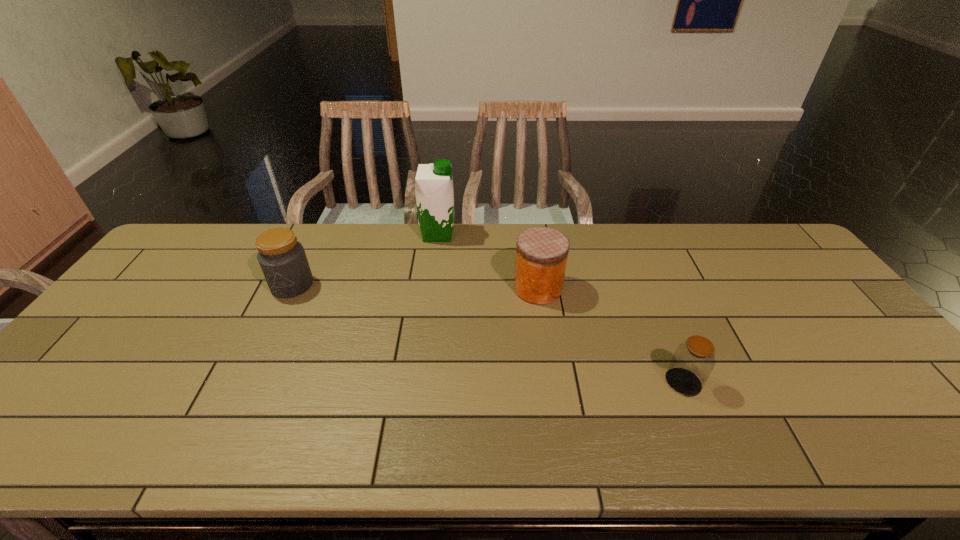
The width and height of the screenshot is (960, 540). I want to click on the third object from right to left, so click(434, 191).

At what (x,y) coordinates should I click in order to perform the action: click on soya milk. Please return your answer as a coordinate pair (x, y). Looking at the image, I should click on (434, 191).

Identify the location of the leftmost jar. (283, 261).

This screenshot has width=960, height=540. Find the location of `the second jar from right to left`. the second jar from right to left is located at coordinates (541, 256).

This screenshot has height=540, width=960. Identify the location of the nearest jar. (693, 361).

At what (x,y) coordinates should I click in order to perform the action: click on the rightmost object. Please return your answer as a coordinate pair (x, y). The width and height of the screenshot is (960, 540). Looking at the image, I should click on (693, 361).

Locate an element on the screen. The height and width of the screenshot is (540, 960). free space located 0.340m on the front-facing side of the farthest object is located at coordinates (554, 234).

The height and width of the screenshot is (540, 960). Find the location of `vacant space positioned on the surface of the leftmost object near the warning symbol`. vacant space positioned on the surface of the leftmost object near the warning symbol is located at coordinates (244, 387).

This screenshot has width=960, height=540. Identify the location of vacant space located 0.400m on the right of the third object from left to right. (696, 288).

You are a GUI agent. You are given a task and a screenshot of the screen. Output one action in this format:
    pyautogui.click(x=<x>, y=<y>)
    Task: Click on the free spot located on the left of the rightmost object
    This screenshot has width=960, height=540.
    Given the screenshot: What is the action you would take?
    pyautogui.click(x=583, y=382)